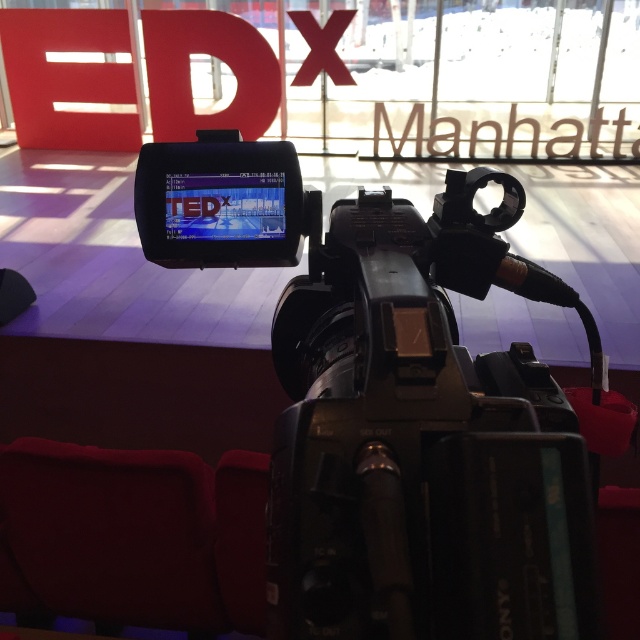
Is the position of black plastic video camera at center more distant than that of velvet red chair at lower left?

No, black plastic video camera at center is closer to the viewer.

Can you confirm if black plastic video camera at center is positioned to the right of velvet red chair at lower left?

Indeed, black plastic video camera at center is positioned on the right side of velvet red chair at lower left.

Locate an element on the screen. black plastic video camera at center is located at coordinates (392, 403).